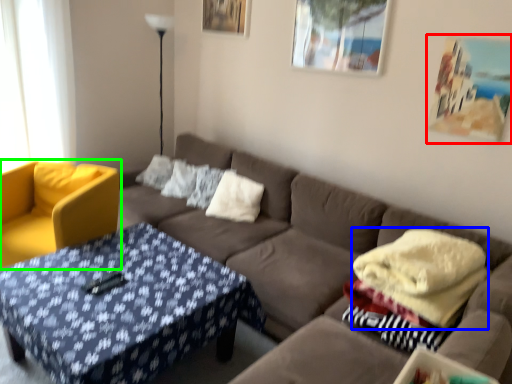
Question: Based on their relative distances, which object is nearer to picture frame (highlighted by a red box)? Choose from blanket (highlighted by a blue box) and chair (highlighted by a green box).

Choices:
 (A) blanket
 (B) chair

Answer: (A)